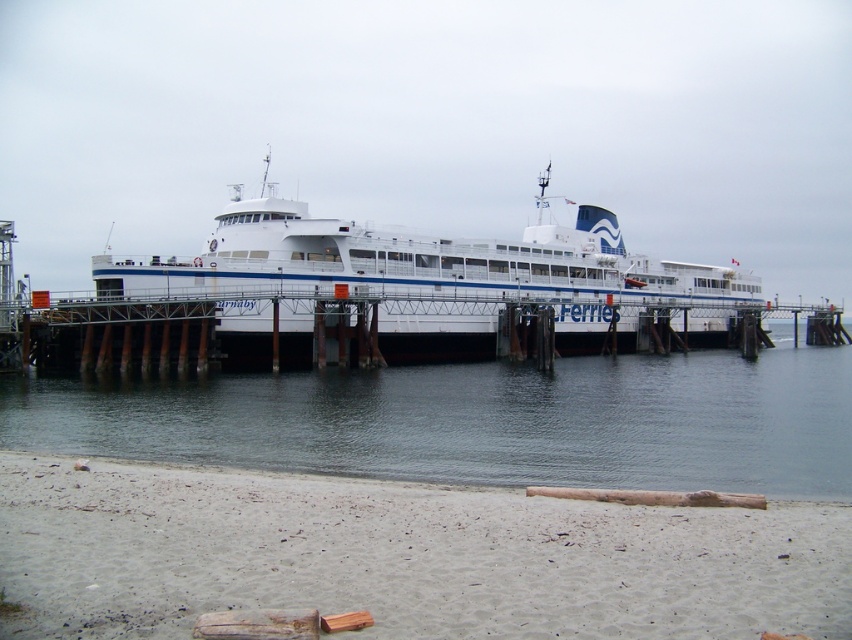
You are a passenger standing on the pier and want to board the white matte ferry at center. Which direction should you walk to reach it from the clear water at center?

The clear water at center is located below the white matte ferry at center, so you should walk towards the white matte ferry at center from the clear water at center.

Consider the image. You are standing on the pier and want to take a photo of the ferry. You notice the clear water at center and the wooden at center in your viewfinder. Which object should you focus on to ensure the ferry is sharp in your photo?

You should focus on the wooden at center because it is farther from the viewer than the clear water at center, ensuring the ferry remains sharp.

You are a delivery person needing to transport a 25 feet long cargo container from the wooden at center to the white matte ferry at center. Can you safely move the container between them without it touching either structure?

The distance between the white matte ferry at center and wooden at center is 26.97 feet. Since the cargo container is 25 feet long, there is enough space to move it safely without touching either structure.